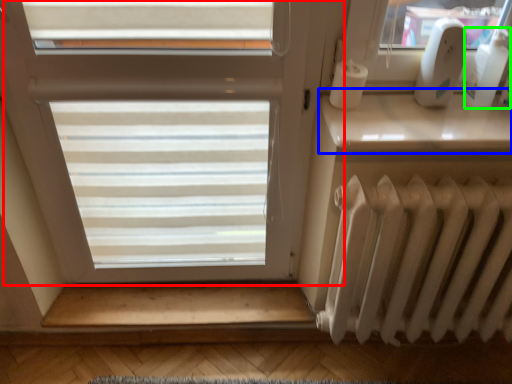
Question: Estimate the real-world distances between objects in this image. Which object is closer to window (highlighted by a red box), window sill (highlighted by a blue box) or toiletry (highlighted by a green box)?

Choices:
 (A) window sill
 (B) toiletry

Answer: (A)